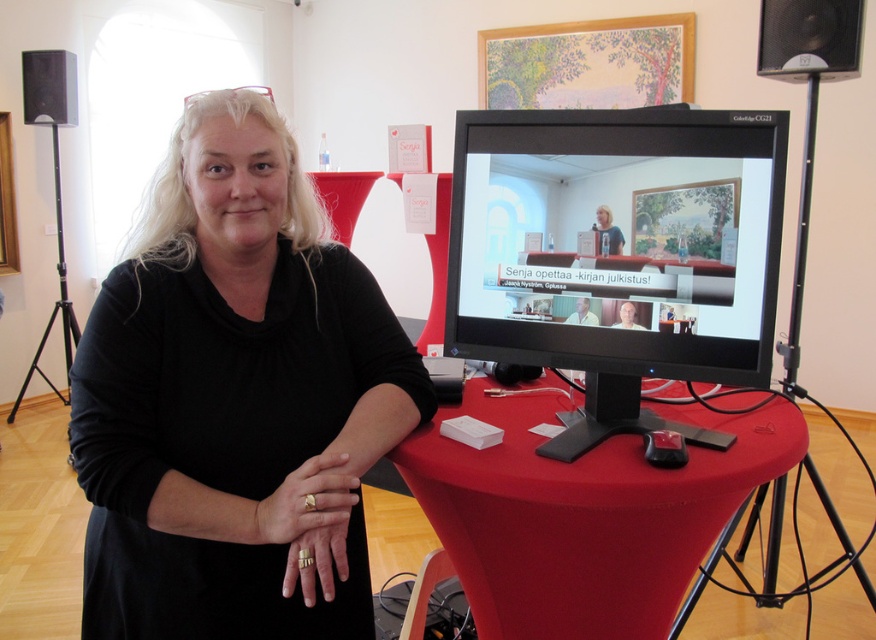
You are organizing a virtual book launch event and need to place a 1.5 meter long banner between the smooth red table at center and the black plastic speaker at upper right. Is there enough space to fit the banner horizontally between them?

The smooth red table at center and the black plastic speaker at upper right are 1.44 meters apart from each other. Since the banner is 1.5 meters long, there isn not enough space to fit the banner horizontally between them.

You are setting up for a virtual book launch event and need to place a microphone exactly 10 cm to the right of the black plastic speaker at upper right. Given the speaker is at coordinates 0.061, 0.925, can you determine the new coordinates for the microphone placement?

The black plastic speaker at upper right is located at point (809, 38). To place the microphone 10 cm to the right, you would adjust the x coordinate by adding 10 cm. However, without knowing the image scale, precise coordinates can not be determined. Please ensure the microphone is positioned appropriately relative to the speaker.